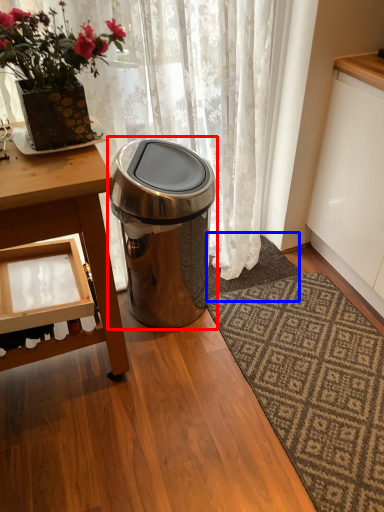
Question: Which point is further to the camera, trash bin/can (highlighted by a red box) or doormat (highlighted by a blue box)?

Choices:
 (A) trash bin/can
 (B) doormat

Answer: (B)